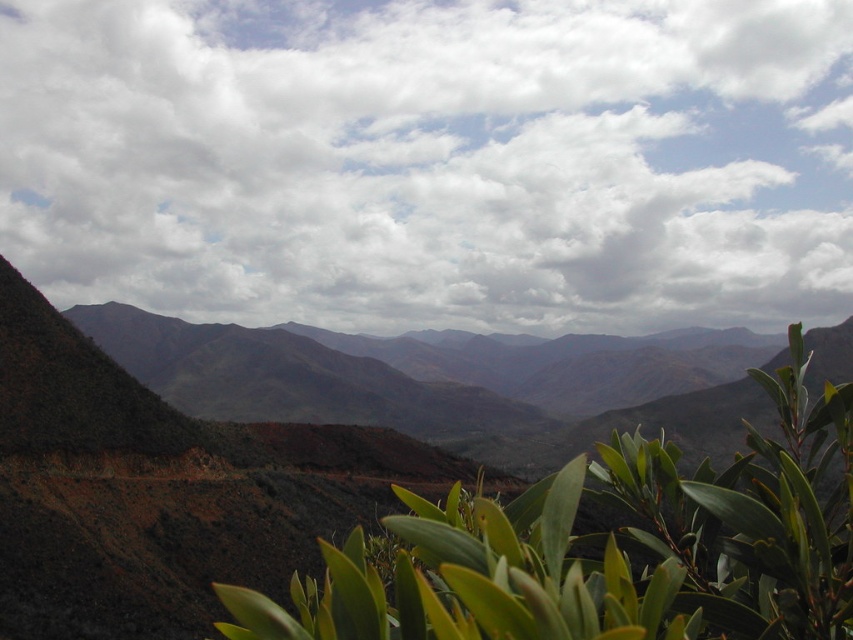
Question: Is the position of white fluffy cloud at upper center more distant than that of green leafy plant at center?

Choices:
 (A) yes
 (B) no

Answer: (A)

Question: Observing the image, what is the correct spatial positioning of white fluffy cloud at upper center in reference to green leafy plant at center?

Choices:
 (A) left
 (B) right

Answer: (A)

Question: Considering the relative positions of white fluffy cloud at upper center and green leafy plant at center in the image provided, where is white fluffy cloud at upper center located with respect to green leafy plant at center?

Choices:
 (A) below
 (B) above

Answer: (B)

Question: Which point is farther from the camera taking this photo?

Choices:
 (A) (830, 104)
 (B) (405, 492)

Answer: (A)